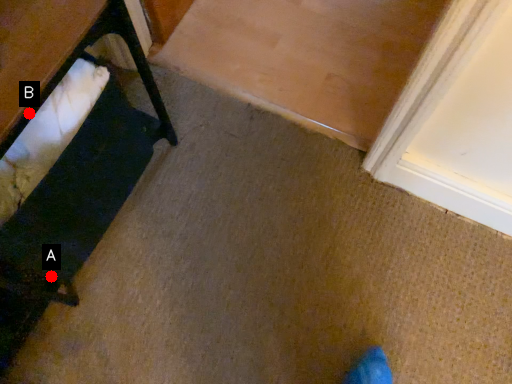
Question: Two points are circled on the image, labeled by A and B beside each circle. Which point is closer to the camera?

Choices:
 (A) A is closer
 (B) B is closer

Answer: (B)